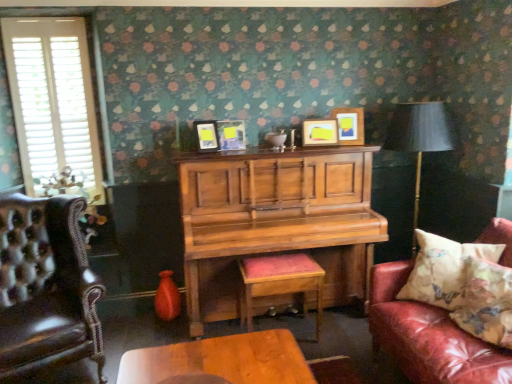
The width and height of the screenshot is (512, 384). In order to click on floral fabric cushion at right, the 1th pillow when ordered from back to front in this screenshot , I will do `click(443, 270)`.

Where is `wooden piano at center`? The width and height of the screenshot is (512, 384). wooden piano at center is located at coordinates (276, 221).

How much space does matte black picture frame at center, the fourth picture frame in the right-to-left sequence, occupy vertically?

matte black picture frame at center, the fourth picture frame in the right-to-left sequence, is 24.19 centimeters tall.

What do you see at coordinates (206, 136) in the screenshot? Image resolution: width=512 pixels, height=384 pixels. I see `matte black picture frame at center, the first picture frame positioned from the left` at bounding box center [206, 136].

What is the approximate height of wooden cushioned stool at center?

The height of wooden cushioned stool at center is 53.07 centimeters.

The width and height of the screenshot is (512, 384). Describe the element at coordinates (53, 100) in the screenshot. I see `white wooden shutters at left` at that location.

Locate an element on the screen. The height and width of the screenshot is (384, 512). floral fabric cushion at right, the 2th pillow positioned from the front is located at coordinates (443, 270).

Considering the sizes of objects leather tufted armchair at left and leather couch with floral pillow at right in the image provided, who is taller, leather tufted armchair at left or leather couch with floral pillow at right?

Standing taller between the two is leather tufted armchair at left.

Considering the sizes of leather tufted armchair at left and leather couch with floral pillow at right in the image, is leather tufted armchair at left wider or thinner than leather couch with floral pillow at right?

In the image, leather tufted armchair at left appears to be more narrow than leather couch with floral pillow at right.

Identify the location of chair above the leather couch with floral pillow at right (from the image's perspective). The width and height of the screenshot is (512, 384). [x=46, y=286].

Based on the photo, between matte yellow picture frame at upper right, the 1th picture frame in the right-to-left sequence, and leather tufted armchair at left, which one is positioned behind?

matte yellow picture frame at upper right, the 1th picture frame in the right-to-left sequence, is behind.

From a real-world perspective, which object rests below the other?

In real-world perspective, leather tufted armchair at left is lower.

From the picture: From the image's perspective, between matte yellow picture frame at upper right, the 4th picture frame viewed from the left, and leather tufted armchair at left, who is located below?

leather tufted armchair at left appears lower in the image.

Considering the relative positions of matte yellow picture frame at upper right, the 1th picture frame in the right-to-left sequence, and leather tufted armchair at left in the image provided, is matte yellow picture frame at upper right, the 1th picture frame in the right-to-left sequence, to the right of leather tufted armchair at left from the viewer's perspective?

Correct, you'll find matte yellow picture frame at upper right, the 1th picture frame in the right-to-left sequence, to the right of leather tufted armchair at left.

From the image's perspective, is matte black lampshade at right located beneath floral fabric cushion at right, which is counted as the first pillow, starting from the front?

Incorrect, from the image's perspective, matte black lampshade at right is higher than floral fabric cushion at right, which is counted as the first pillow, starting from the front.

Is point (452, 136) farther from viewer compared to point (482, 283)?

Yes, it is behind point (482, 283).

Is matte black lampshade at right wider than floral fabric cushion at right, which is counted as the first pillow, starting from the front?

Indeed, matte black lampshade at right has a greater width compared to floral fabric cushion at right, which is counted as the first pillow, starting from the front.

Is matte black lampshade at right oriented towards floral fabric cushion at right, positioned as the second pillow in back-to-front order?

Yes, matte black lampshade at right is aimed at floral fabric cushion at right, positioned as the second pillow in back-to-front order.

From the image's perspective, which one is positioned higher, wooden cushioned stool at center or leather couch with floral pillow at right?

leather couch with floral pillow at right.

Consider the image. Is wooden cushioned stool at center smaller than leather couch with floral pillow at right?

Yes, wooden cushioned stool at center is smaller than leather couch with floral pillow at right.

At what (x,y) coordinates should I click in order to perform the action: click on studio couch on the right side of wooden cushioned stool at center. Please return your answer as a coordinate pair (x, y). Image resolution: width=512 pixels, height=384 pixels. Looking at the image, I should click on (429, 337).

Based on the photo, is wooden cushioned stool at center at the left side of leather couch with floral pillow at right?

Indeed, wooden cushioned stool at center is positioned on the left side of leather couch with floral pillow at right.

Is matte yellow picture frame at upper right, the 4th picture frame viewed from the left, far away from wooden piano at center?

Actually, matte yellow picture frame at upper right, the 4th picture frame viewed from the left, and wooden piano at center are a little close together.

Considering the positions of point (355, 129) and point (313, 215), is point (355, 129) closer or farther from the camera than point (313, 215)?

Point (355, 129) is farther from the camera than point (313, 215).

Is matte yellow picture frame at upper right, the 1th picture frame in the right-to-left sequence, oriented towards wooden piano at center?

No, matte yellow picture frame at upper right, the 1th picture frame in the right-to-left sequence, is not facing towards wooden piano at center.

From a real-world perspective, is wooden cushioned stool at center physically below floral fabric cushion at right, the 1th pillow when ordered from back to front?

Indeed, from a real-world perspective, wooden cushioned stool at center is positioned beneath floral fabric cushion at right, the 1th pillow when ordered from back to front.

Considering the sizes of wooden cushioned stool at center and floral fabric cushion at right, the 2th pillow positioned from the front, in the image, is wooden cushioned stool at center wider or thinner than floral fabric cushion at right, the 2th pillow positioned from the front,?

wooden cushioned stool at center is wider than floral fabric cushion at right, the 2th pillow positioned from the front.

Considering their positions, is wooden cushioned stool at center located in front of or behind floral fabric cushion at right, the 1th pillow when ordered from back to front?

In the image, wooden cushioned stool at center appears behind floral fabric cushion at right, the 1th pillow when ordered from back to front.

From the image's perspective, which one is positioned lower, wooden cushioned stool at center or floral fabric cushion at right, the 1th pillow when ordered from back to front?

From the image's view, wooden cushioned stool at center is below.

From the picture: From the image's perspective, between matte yellow picture frame at upper right, the 4th picture frame viewed from the left, and wooden cushioned stool at center, who is located below?

wooden cushioned stool at center appears lower in the image.

Does matte yellow picture frame at upper right, the 4th picture frame viewed from the left, appear on the right side of wooden cushioned stool at center?

Yes.

Which object is more forward, matte yellow picture frame at upper right, the 1th picture frame in the right-to-left sequence, or wooden cushioned stool at center?

wooden cushioned stool at center is closer to the camera.

From a real-world perspective, between matte yellow picture frame at upper right, the 1th picture frame in the right-to-left sequence, and wooden cushioned stool at center, who is vertically lower?

wooden cushioned stool at center, from a real-world perspective.

Identify the location of chair on the left of the leather couch with floral pillow at right. (46, 286).

At what (x,y) coordinates should I click in order to perform the action: click on chair below the matte yellow picture frame at upper right, the 1th picture frame in the right-to-left sequence (from the image's perspective). Please return your answer as a coordinate pair (x, y). Looking at the image, I should click on (46, 286).

Which object lies further to the anchor point wooden cushioned stool at center, wooden piano at center or matte black picture frame at center, which is counted as the 2th picture frame, starting from the left?

matte black picture frame at center, which is counted as the 2th picture frame, starting from the left, is positioned further to the anchor wooden cushioned stool at center.

Estimate the real-world distances between objects in this image. Which object is further from matte black picture frame at center, the fourth picture frame in the right-to-left sequence, matte black picture frame at center, which is counted as the 2th picture frame, starting from the left, or matte yellow picture frame at upper right, the 1th picture frame in the right-to-left sequence?

Based on the image, matte yellow picture frame at upper right, the 1th picture frame in the right-to-left sequence, appears to be further to matte black picture frame at center, the fourth picture frame in the right-to-left sequence.

From the image, which object appears to be nearer to wooden cushioned stool at center, floral fabric cushion at right, which is counted as the first pillow, starting from the front, or wooden piano at center?

wooden piano at center lies closer to wooden cushioned stool at center than the other object.

When comparing their distances from matte black picture frame at center, which is counted as the 2th picture frame, starting from the left, does matte wooden picture frame at upper center, which appears as the 3th picture frame when viewed from the left, or leather tufted armchair at left seem further?

leather tufted armchair at left lies further to matte black picture frame at center, which is counted as the 2th picture frame, starting from the left, than the other object.

Which object lies nearer to the anchor point matte black lampshade at right, matte black picture frame at center, which is counted as the 2th picture frame, starting from the left, or matte black picture frame at center, the fourth picture frame in the right-to-left sequence?

matte black picture frame at center, which is counted as the 2th picture frame, starting from the left, is positioned closer to the anchor matte black lampshade at right.

From the picture: Looking at the image, which one is located further to floral fabric cushion at right, positioned as the second pillow in back-to-front order, floral fabric cushion at right, the 2th pillow positioned from the front, or matte wooden picture frame at upper center, positioned as the 2th picture frame in right-to-left order?

The object further to floral fabric cushion at right, positioned as the second pillow in back-to-front order, is matte wooden picture frame at upper center, positioned as the 2th picture frame in right-to-left order.

When comparing their distances from wooden cushioned stool at center, does matte yellow picture frame at upper right, the 1th picture frame in the right-to-left sequence, or matte black picture frame at center, the first picture frame positioned from the left, seem closer?

The object closer to wooden cushioned stool at center is matte black picture frame at center, the first picture frame positioned from the left.

Which object lies nearer to the anchor point matte black picture frame at center, the first picture frame positioned from the left, floral fabric cushion at right, the 1th pillow when ordered from back to front, or matte wooden picture frame at upper center, which appears as the 3th picture frame when viewed from the left?

The object closer to matte black picture frame at center, the first picture frame positioned from the left, is matte wooden picture frame at upper center, which appears as the 3th picture frame when viewed from the left.

What are the coordinates of `stool between white wooden shutters at left and floral fabric cushion at right, which is counted as the first pillow, starting from the front, in the horizontal direction` in the screenshot? It's located at (x=279, y=282).

At what (x,y) coordinates should I click in order to perform the action: click on table lamp positioned between floral fabric cushion at right, positioned as the second pillow in back-to-front order, and matte wooden picture frame at upper center, positioned as the 2th picture frame in right-to-left order, from near to far. Please return your answer as a coordinate pair (x, y). Looking at the image, I should click on (420, 135).

Where is `pillow situated between white wooden shutters at left and floral fabric cushion at right, which is counted as the first pillow, starting from the front, from left to right`? pillow situated between white wooden shutters at left and floral fabric cushion at right, which is counted as the first pillow, starting from the front, from left to right is located at coordinates (443, 270).

Find the location of a particular element. The height and width of the screenshot is (384, 512). dresser between white wooden shutters at left and matte black lampshade at right in the horizontal direction is located at coordinates (276, 221).